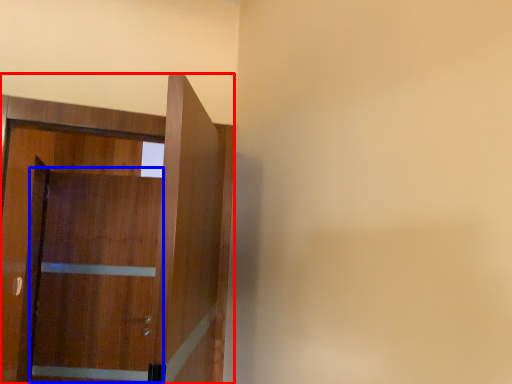
Question: Which object appears farthest to the camera in this image, door (highlighted by a red box) or barn door (highlighted by a blue box)?

Choices:
 (A) door
 (B) barn door

Answer: (B)